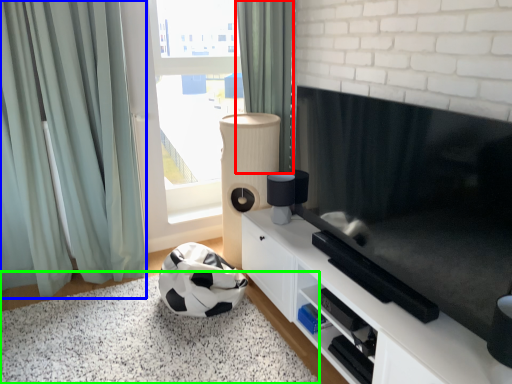
Question: Estimate the real-world distances between objects in this image. Which object is closer to curtain (highlighted by a red box), curtain (highlighted by a blue box) or plain (highlighted by a green box)?

Choices:
 (A) curtain
 (B) plain

Answer: (A)